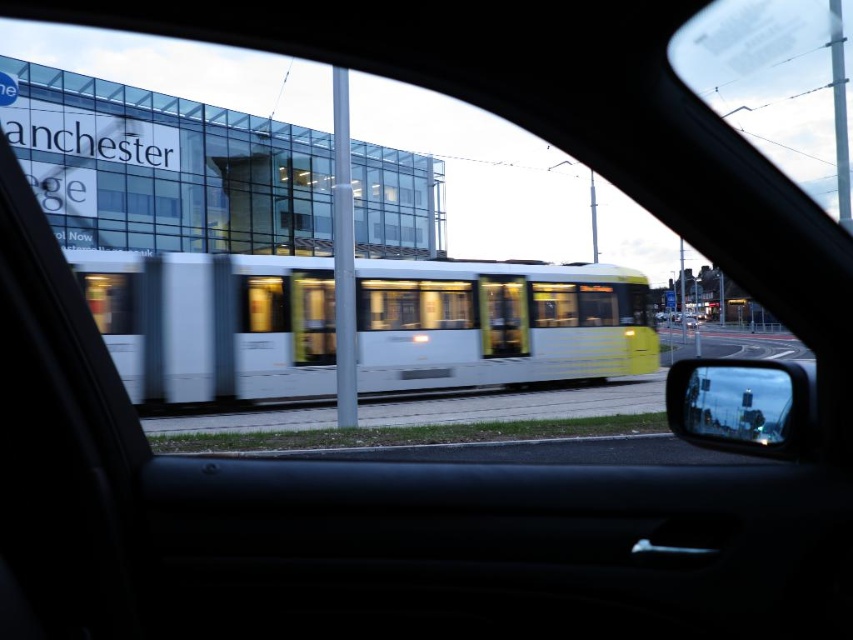
Can you confirm if white glossy train at center is wider than reflective glass mirror at right?

Yes.

This screenshot has height=640, width=853. In order to click on white glossy train at center in this screenshot , I will do `click(498, 323)`.